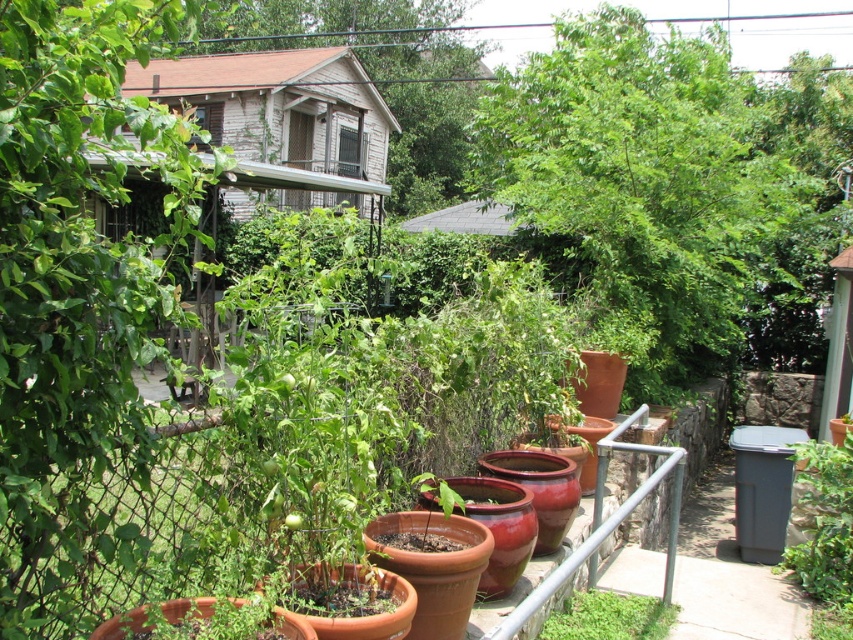
Is green matte plant at lower right positioned in front of green matte plant at lower center?

No, green matte plant at lower right is behind green matte plant at lower center.

Does green matte plant at lower right have a greater height compared to green matte plant at lower center?

Yes, green matte plant at lower right is taller than green matte plant at lower center.

Which is in front, point (839, 545) or point (646, 612)?

Point (646, 612)

At what (x,y) coordinates should I click in order to perform the action: click on green matte plant at lower right. Please return your answer as a coordinate pair (x, y). Looking at the image, I should click on (825, 534).